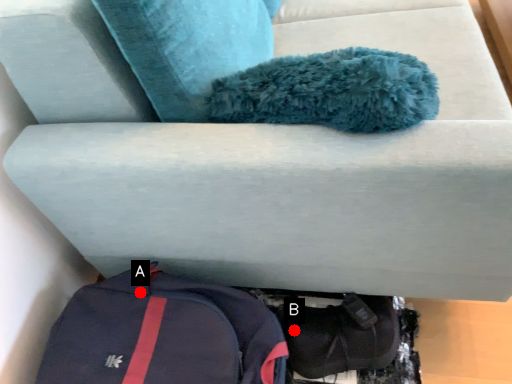
Question: Two points are circled on the image, labeled by A and B beside each circle. Which point is closer to the camera?

Choices:
 (A) A is closer
 (B) B is closer

Answer: (A)